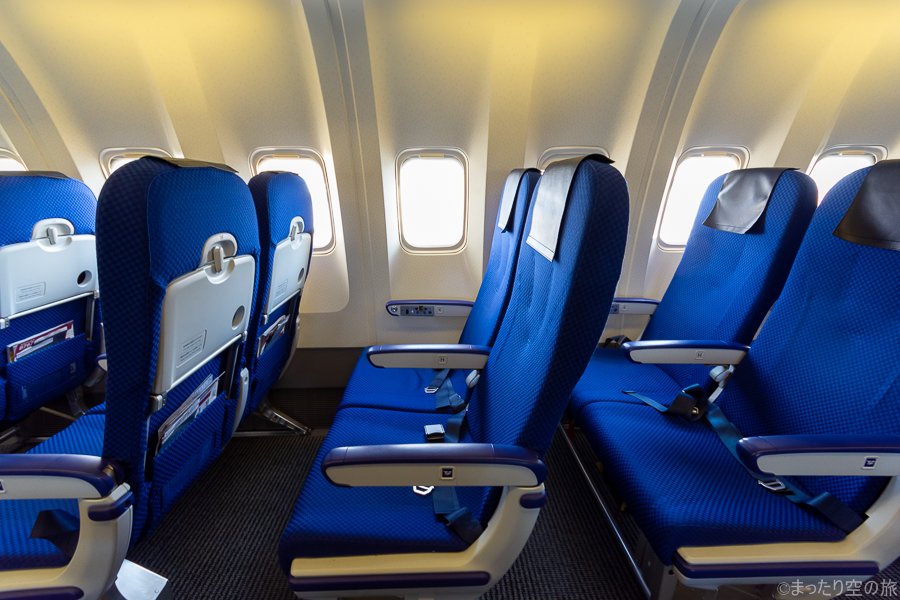
Image resolution: width=900 pixels, height=600 pixels. Identify the location of seat. (31, 194), (176, 209), (285, 205), (493, 274), (533, 304), (711, 305), (815, 385).